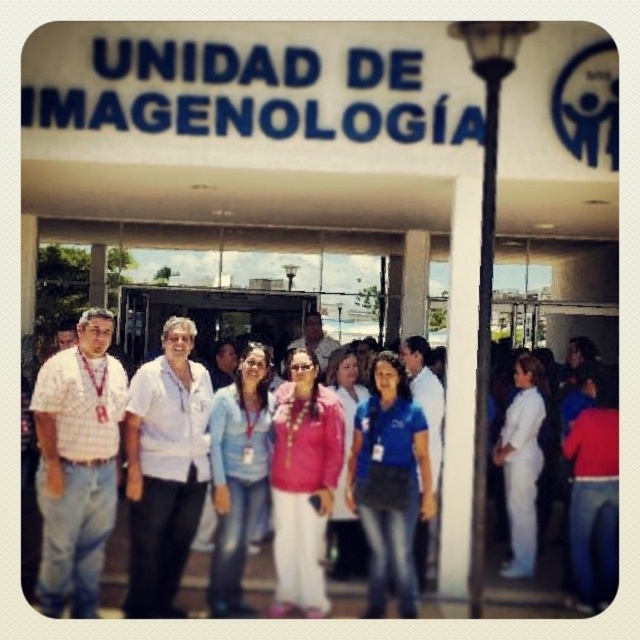
You are a photographer trying to capture a group photo of the people in front of the UNIDAD DE IMAGENOLOGIA entrance. You notice two white clothing items in the scene. Which one is bigger between the white matte shirt at center and the white smooth uniform at right?

The white matte shirt at center is larger in size compared to the white smooth uniform at right.

You are a photographer taking a group photo of the people in front of the UNIDAD DE IMAGENOLOGIA entrance. You notice two white items in the scene. The first is the white matte shirt at center and the second is the white smooth uniform at right. Which of these two white items is positioned higher up in the photo?

The white matte shirt at center is located above the white smooth uniform at right, so the white matte shirt at center is positioned higher up in the photo.

You are a photographer trying to capture a group photo of the people at the entrance of the Imaging Unit. You notice the blue jeans at center and the white smooth uniform at right. Which person should you ask to move closer to the other to avoid appearing too spread out?

The blue jeans at center has a larger width than the white smooth uniform at right, so you should ask the person in the white smooth uniform at right to move closer to the blue jeans at center to balance the spacing between them.